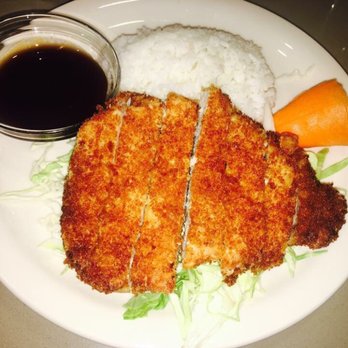
Find the location of a particular element. This screenshot has width=348, height=348. small glass bowl is located at coordinates (24, 133).